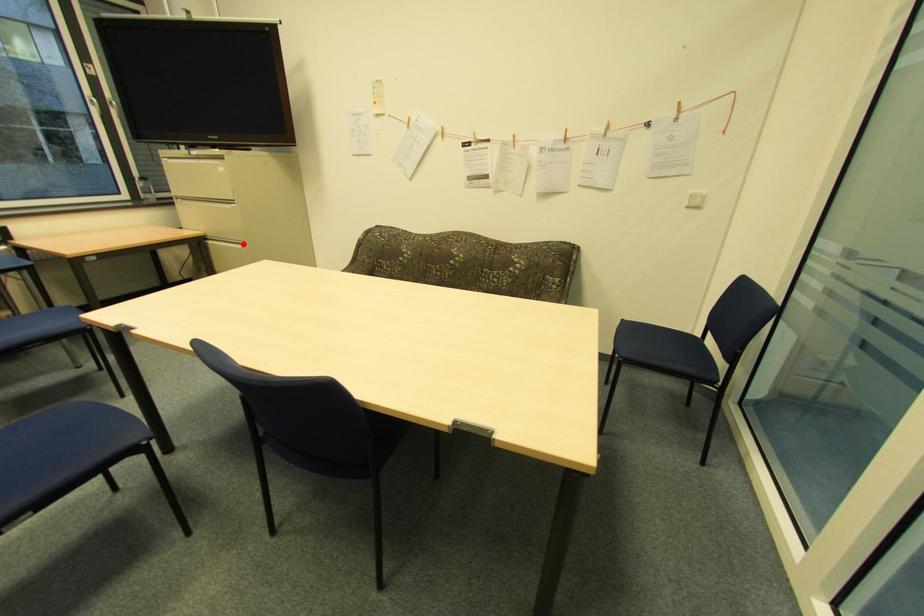
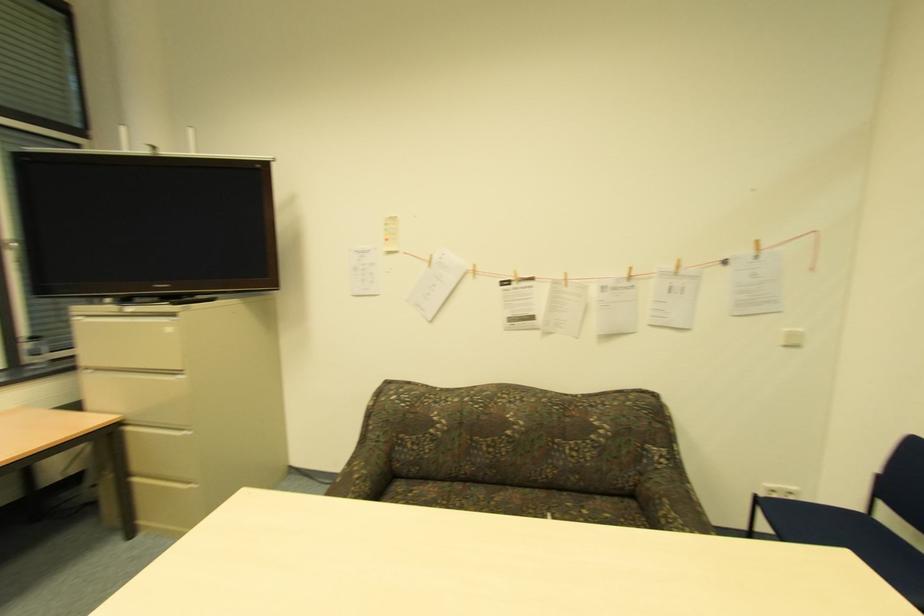
Question: I am providing you with two images of the same scene from different viewpoints. A red point is marked on the first image. Is the red point's position out of view in image 2?

Choices:
 (A) Yes
 (B) No

Answer: (B)